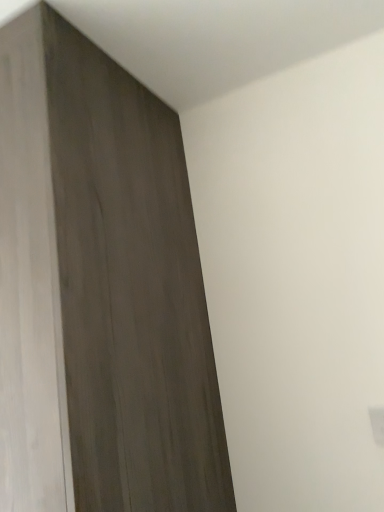
You are a GUI agent. You are given a task and a screenshot of the screen. Output one action in this format:
    pyautogui.click(x=<x>, y=<y>)
    Task: Click on the dark wood cupboard at upper left
    Image resolution: width=384 pixels, height=512 pixels.
    Given the screenshot: What is the action you would take?
    pyautogui.click(x=118, y=274)

What do you see at coordinates (118, 274) in the screenshot? Image resolution: width=384 pixels, height=512 pixels. I see `dark wood cupboard at upper left` at bounding box center [118, 274].

Where is `dark wood cupboard at upper left`? This screenshot has width=384, height=512. dark wood cupboard at upper left is located at coordinates (118, 274).